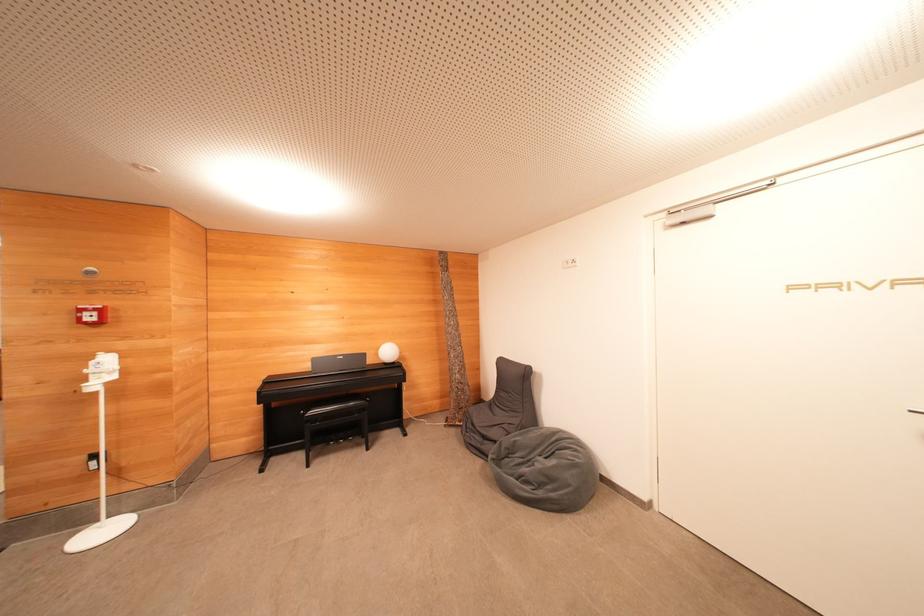
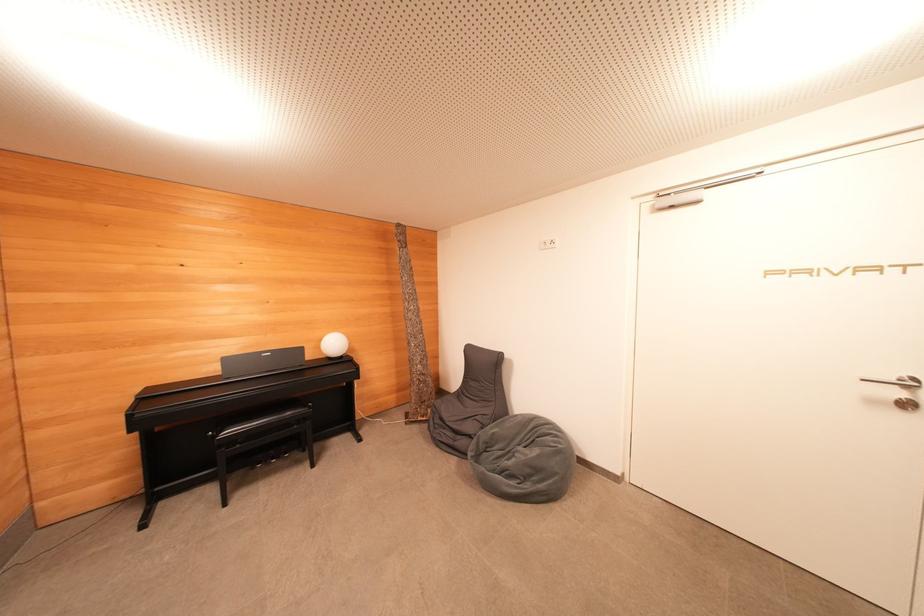
Find the pixel in the second image that matches point 319,363 in the first image.

(229, 363)